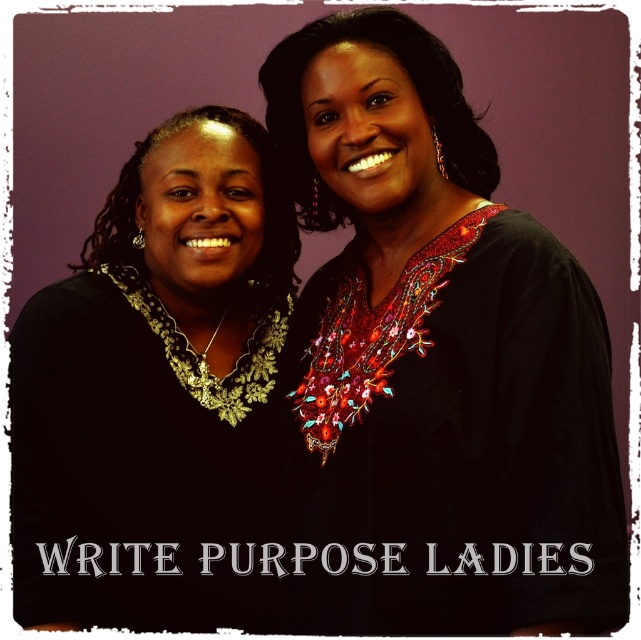
Can you confirm if black embroidered blouse at center is positioned below matte black blouse at upper center?

Correct, black embroidered blouse at center is located below matte black blouse at upper center.

Is black embroidered blouse at center to the right of matte black blouse at upper center from the viewer's perspective?

Correct, you'll find black embroidered blouse at center to the right of matte black blouse at upper center.

From the picture: Who is more distant from viewer, (369, 269) or (469, 176)?

The point (469, 176) is more distant.

Image resolution: width=641 pixels, height=640 pixels. I want to click on black embroidered blouse at center, so click(x=437, y=358).

Looking at this image, between matte black blouse at upper center and matte gold necklace at left, which one is positioned lower?

matte gold necklace at left is lower down.

The image size is (641, 640). Describe the element at coordinates (413, 86) in the screenshot. I see `matte black blouse at upper center` at that location.

The height and width of the screenshot is (640, 641). What do you see at coordinates (413, 86) in the screenshot?
I see `matte black blouse at upper center` at bounding box center [413, 86].

Where is `matte black blouse at upper center`? Image resolution: width=641 pixels, height=640 pixels. matte black blouse at upper center is located at coordinates (413, 86).

Is black embroidered blouse at center in front of matte black necklace at left?

Yes, black embroidered blouse at center is in front of matte black necklace at left.

Can you confirm if black embroidered blouse at center is bigger than matte black necklace at left?

Correct, black embroidered blouse at center is larger in size than matte black necklace at left.

Between point (383, 392) and point (176, 541), which one is positioned in front?

Point (383, 392) is in front.

Locate an element on the screen. This screenshot has height=640, width=641. black embroidered blouse at center is located at coordinates (437, 358).